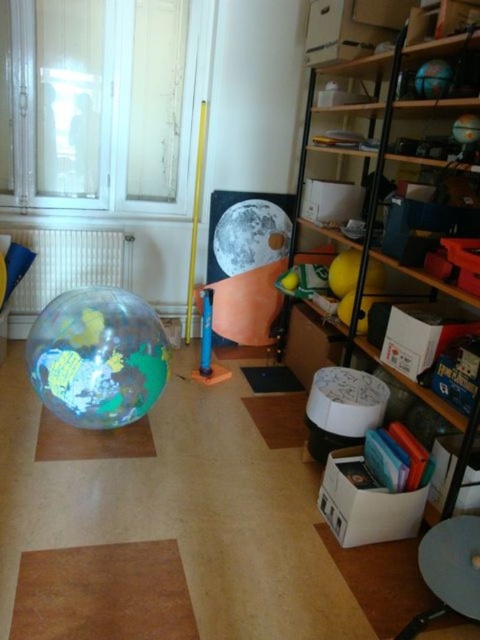
Is wooden shelves at right thinner than shiny metallic moon at center?

No, wooden shelves at right is not thinner than shiny metallic moon at center.

What do you see at coordinates (387, 173) in the screenshot? The height and width of the screenshot is (640, 480). I see `wooden shelves at right` at bounding box center [387, 173].

Is point (393, 54) closer to viewer compared to point (244, 262)?

That is True.

This screenshot has height=640, width=480. I want to click on wooden shelves at right, so click(387, 173).

Is transparent plastic globe at center to the left of shiny metallic moon at center from the viewer's perspective?

Correct, you'll find transparent plastic globe at center to the left of shiny metallic moon at center.

Which of these two, transparent plastic globe at center or shiny metallic moon at center, stands shorter?

shiny metallic moon at center is shorter.

Who is more distant from viewer, (x=133, y=332) or (x=279, y=227)?

The point (x=279, y=227) is behind.

The height and width of the screenshot is (640, 480). Identify the location of transparent plastic globe at center. (97, 356).

Who is more forward, (418, 124) or (69, 419)?

Positioned in front is point (69, 419).

Based on the photo, measure the distance between point (396, 259) and camera.

They are 2.25 meters apart.

This screenshot has width=480, height=640. What do you see at coordinates (387, 173) in the screenshot? I see `wooden shelves at right` at bounding box center [387, 173].

Image resolution: width=480 pixels, height=640 pixels. What are the coordinates of `wooden shelves at right` in the screenshot? It's located at (387, 173).